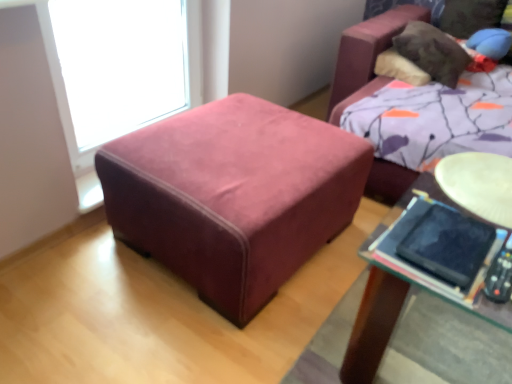
The height and width of the screenshot is (384, 512). What do you see at coordinates (479, 184) in the screenshot?
I see `light brown wooden round table at center right` at bounding box center [479, 184].

You are a GUI agent. You are given a task and a screenshot of the screen. Output one action in this format:
    pyautogui.click(x=<x>, y=<y>)
    Task: Click on the velvet ottoman at center
    This screenshot has width=512, height=384.
    Given the screenshot: What is the action you would take?
    pyautogui.click(x=233, y=196)

Which is closer to the camera, [465,219] or [225,164]?

Point [465,219]

Is black matte tablet at lower right at the right side of velvet ottoman at center?

Yes.

Are black matte tablet at lower right and velvet ottoman at center far apart?

black matte tablet at lower right is actually quite close to velvet ottoman at center.

This screenshot has height=384, width=512. In order to click on table below the black matte tablet at lower right (from a real-world perspective) in this screenshot , I will do pos(233,196).

From the image's perspective, would you say light brown wooden round table at center right is shown under black matte tablet at lower right?

No.

You are a GUI agent. You are given a task and a screenshot of the screen. Output one action in this format:
    pyautogui.click(x=<x>, y=<y>)
    Task: Click on the round table above the black matte tablet at lower right (from the image's perspective)
    This screenshot has width=512, height=384.
    Given the screenshot: What is the action you would take?
    pyautogui.click(x=479, y=184)

Between light brown wooden round table at center right and black matte tablet at lower right, which one has smaller width?

With smaller width is black matte tablet at lower right.

Is point (500, 196) positioned after point (458, 243)?

That is True.

The image size is (512, 384). In the image, there is a transparent glass window at upper left. In order to click on ipad below it (from the image's perspective) in this screenshot , I will do `click(448, 246)`.

Considering the relative positions of black matte tablet at lower right and transparent glass window at upper left in the image provided, is black matte tablet at lower right to the right of transparent glass window at upper left from the viewer's perspective?

Correct, you'll find black matte tablet at lower right to the right of transparent glass window at upper left.

From the image's perspective, is black matte tablet at lower right above or below transparent glass window at upper left?

Clearly, from the image's perspective, black matte tablet at lower right is below transparent glass window at upper left.

Between black matte tablet at lower right and transparent glass window at upper left, which one has smaller size?

With smaller size is black matte tablet at lower right.

Considering the relative sizes of light brown wooden round table at center right and transparent glass window at upper left in the image provided, is light brown wooden round table at center right shorter than transparent glass window at upper left?

Correct, light brown wooden round table at center right is not as tall as transparent glass window at upper left.

From a real-world perspective, is light brown wooden round table at center right physically located above or below transparent glass window at upper left?

In terms of real-world spatial position, light brown wooden round table at center right is above transparent glass window at upper left.

Is point (507, 159) closer or farther from the camera than point (155, 21)?

Point (507, 159) is positioned closer to the camera compared to point (155, 21).

Is black matte tablet at lower right to the left or to the right of light brown wooden round table at center right in the image?

From the image, it's evident that black matte tablet at lower right is to the left of light brown wooden round table at center right.

Does black matte tablet at lower right have a lesser height compared to light brown wooden round table at center right?

Incorrect, the height of black matte tablet at lower right does not fall short of that of light brown wooden round table at center right.

What's the angular difference between black matte tablet at lower right and light brown wooden round table at center right's facing directions?

They differ by 2.3 degrees in their facing directions.

Is light brown wooden round table at center right inside black matte tablet at lower right?

No, light brown wooden round table at center right is not a part of black matte tablet at lower right.

Is transparent glass window at upper left oriented away from black matte tablet at lower right?

No.

Which is less distant, (x=170, y=10) or (x=460, y=216)?

The point (x=460, y=216) is more forward.

Is point (152, 7) positioned before point (478, 188)?

No, (152, 7) is behind (478, 188).

In the image, is transparent glass window at upper left positioned in front of or behind light brown wooden round table at center right?

In the image, transparent glass window at upper left appears behind light brown wooden round table at center right.

Is transparent glass window at upper left turned away from light brown wooden round table at center right?

No, light brown wooden round table at center right is not at the back of transparent glass window at upper left.

Is transparent glass window at upper left touching light brown wooden round table at center right?

No, transparent glass window at upper left is not touching light brown wooden round table at center right.

The height and width of the screenshot is (384, 512). In order to click on ipad that appears below the velvet ottoman at center (from the image's perspective) in this screenshot , I will do `click(448, 246)`.

This screenshot has height=384, width=512. In order to click on round table above the black matte tablet at lower right (from the image's perspective) in this screenshot , I will do `click(479, 184)`.

When comparing their distances from light brown wooden round table at center right, does velvet ottoman at center or black matte tablet at lower right seem further?

Based on the image, velvet ottoman at center appears to be further to light brown wooden round table at center right.

Which object lies nearer to the anchor point velvet ottoman at center, transparent glass window at upper left or light brown wooden round table at center right?

light brown wooden round table at center right.

Based on the photo, looking at the image, which one is located closer to light brown wooden round table at center right, transparent glass window at upper left or velvet ottoman at center?

Among the two, velvet ottoman at center is located nearer to light brown wooden round table at center right.

Based on their spatial positions, is black matte tablet at lower right or transparent glass window at upper left further from velvet ottoman at center?

Based on the image, transparent glass window at upper left appears to be further to velvet ottoman at center.

When comparing their distances from black matte tablet at lower right, does transparent glass window at upper left or velvet ottoman at center seem further?

transparent glass window at upper left.

From the image, which object appears to be nearer to light brown wooden round table at center right, black matte tablet at lower right or velvet ottoman at center?

The object closer to light brown wooden round table at center right is black matte tablet at lower right.

Estimate the real-world distances between objects in this image. Which object is further from black matte tablet at lower right, transparent glass window at upper left or light brown wooden round table at center right?

transparent glass window at upper left.

Based on their spatial positions, is light brown wooden round table at center right or transparent glass window at upper left further from velvet ottoman at center?

transparent glass window at upper left is further to velvet ottoman at center.

Locate an element on the screen. table situated between transparent glass window at upper left and light brown wooden round table at center right from left to right is located at coordinates (233, 196).

The image size is (512, 384). What are the coordinates of `ipad situated between velvet ottoman at center and light brown wooden round table at center right from left to right` in the screenshot? It's located at (448, 246).

This screenshot has width=512, height=384. I want to click on ipad between transparent glass window at upper left and light brown wooden round table at center right from left to right, so click(x=448, y=246).

Identify the location of table situated between transparent glass window at upper left and black matte tablet at lower right from left to right. (233, 196).